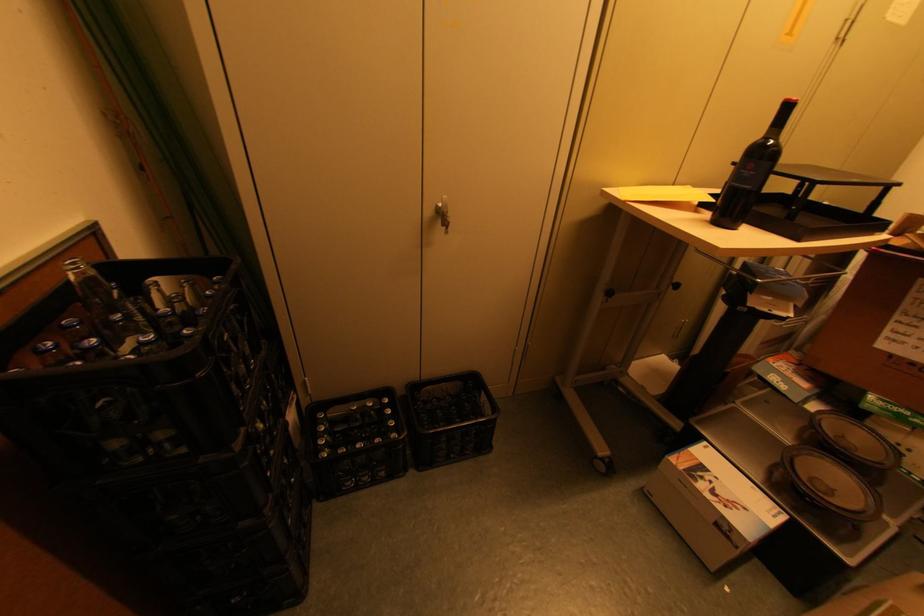
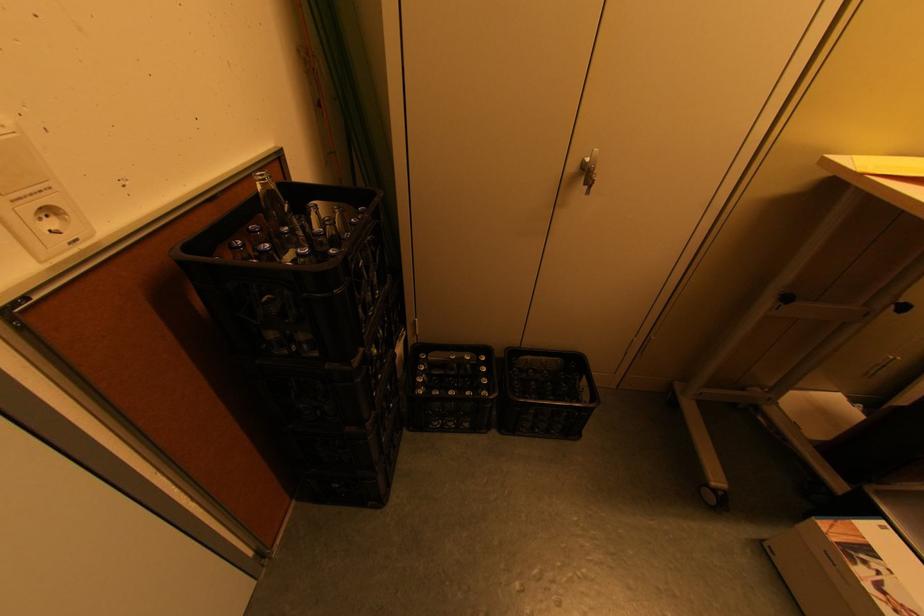
Locate, in the second image, the point that corresponds to the point at 446,225 in the first image.

(588, 185)